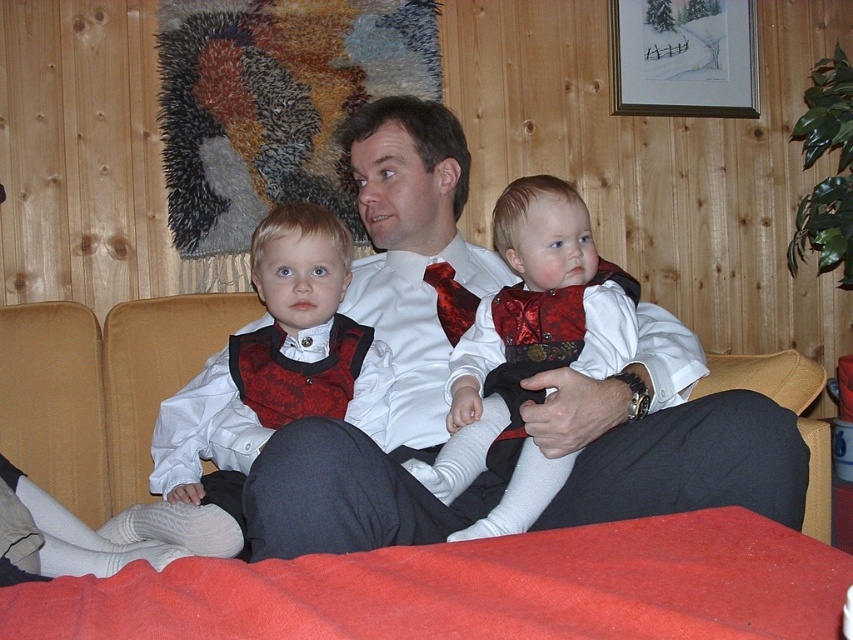
Based on the scene description, can you determine if the white satin shirt at center is wider than the matte black vest at left?

The white satin shirt at center might be wider than matte black vest at left according to the description provided.